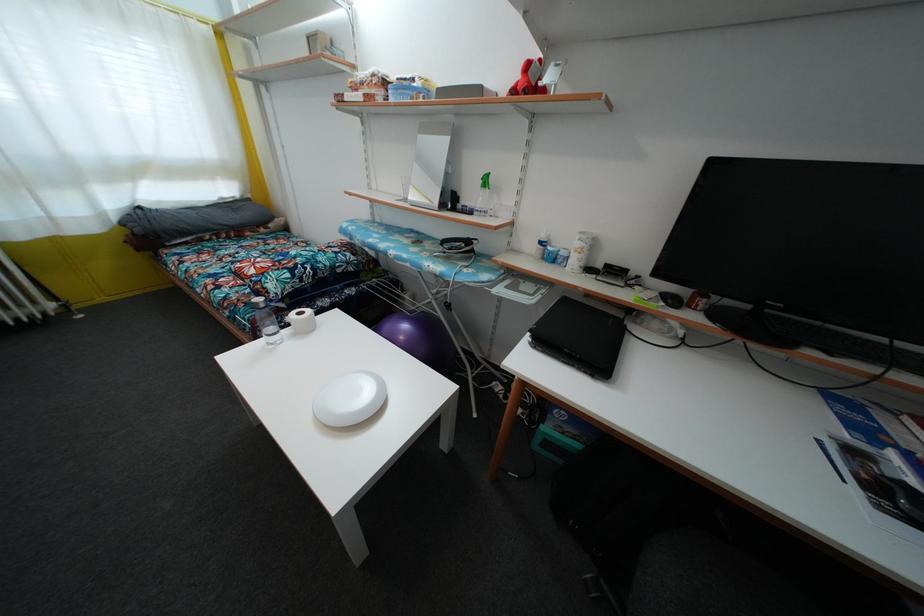
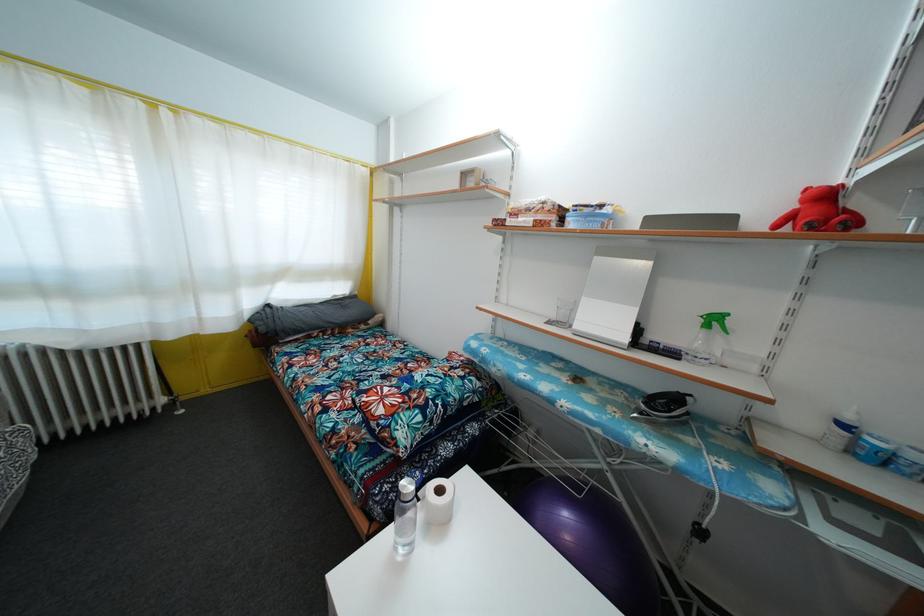
The point at [252,203] is marked in the first image. Where is the corresponding point in the second image?

(359, 300)